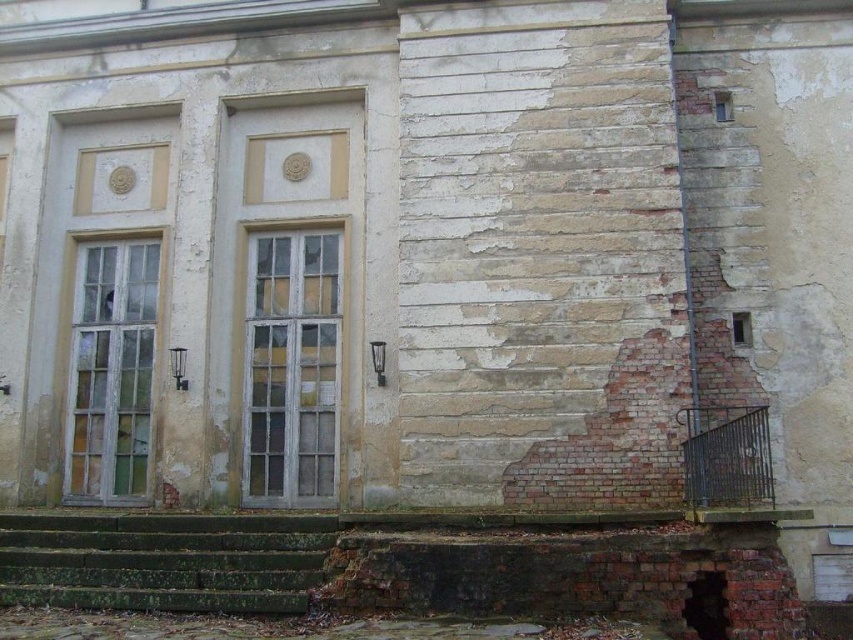
Question: Which point appears closest to the camera in this image?

Choices:
 (A) (94, 392)
 (B) (265, 586)

Answer: (B)

Question: Which object appears closest to the camera in this image?

Choices:
 (A) wooden glass window at left
 (B) white weathered wood window at center
 (C) green mossy stone stairs at lower left

Answer: (C)

Question: Can you confirm if green mossy stone stairs at lower left is positioned above wooden glass window at left?

Choices:
 (A) no
 (B) yes

Answer: (A)

Question: Can you confirm if green mossy stone stairs at lower left is positioned to the left of wooden glass window at left?

Choices:
 (A) yes
 (B) no

Answer: (B)

Question: Is green mossy stone stairs at lower left above wooden glass window at left?

Choices:
 (A) no
 (B) yes

Answer: (A)

Question: Which point appears closest to the camera in this image?

Choices:
 (A) (276, 234)
 (B) (212, 515)

Answer: (B)